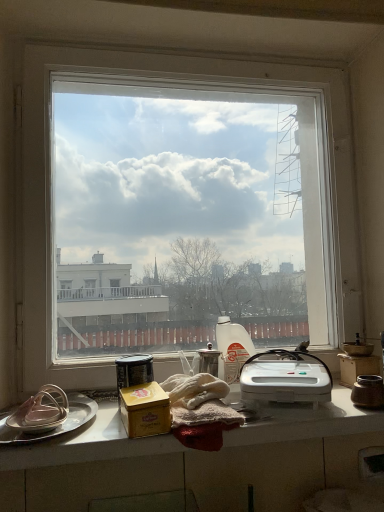
Question: From the image's perspective, is transparent glass window at center under silver metallic platter at left?

Choices:
 (A) yes
 (B) no

Answer: (B)

Question: Does transparent glass window at center lie behind silver metallic platter at left?

Choices:
 (A) no
 (B) yes

Answer: (B)

Question: Considering the relative sizes of transparent glass window at center and silver metallic platter at left in the image provided, is transparent glass window at center bigger than silver metallic platter at left?

Choices:
 (A) no
 (B) yes

Answer: (B)

Question: Is transparent glass window at center completely or partially outside of silver metallic platter at left?

Choices:
 (A) no
 (B) yes

Answer: (B)

Question: Is transparent glass window at center at the left side of silver metallic platter at left?

Choices:
 (A) no
 (B) yes

Answer: (A)

Question: In terms of width, does white glossy countertop at lower center look wider or thinner when compared to matte silver lid at left, marked as the first appliance in a left-to-right arrangement?

Choices:
 (A) thin
 (B) wide

Answer: (B)

Question: Is point (329, 483) closer or farther from the camera than point (41, 417)?

Choices:
 (A) closer
 (B) farther

Answer: (B)

Question: Is white glossy countertop at lower center to the left or to the right of matte silver lid at left, marked as the first appliance in a left-to-right arrangement, in the image?

Choices:
 (A) left
 (B) right

Answer: (B)

Question: From their relative heights in the image, would you say white glossy countertop at lower center is taller or shorter than matte silver lid at left, the sixth appliance when ordered from right to left?

Choices:
 (A) tall
 (B) short

Answer: (B)

Question: Considering the positions of transparent glass window at center and metallic canister at center, marked as the second appliance in a left-to-right arrangement, in the image, is transparent glass window at center bigger or smaller than metallic canister at center, marked as the second appliance in a left-to-right arrangement,?

Choices:
 (A) small
 (B) big

Answer: (B)

Question: Is point (170, 297) closer or farther from the camera than point (122, 378)?

Choices:
 (A) farther
 (B) closer

Answer: (A)

Question: From their relative heights in the image, would you say transparent glass window at center is taller or shorter than metallic canister at center, the fifth appliance viewed from the right?

Choices:
 (A) short
 (B) tall

Answer: (B)

Question: Would you say transparent glass window at center is inside or outside metallic canister at center, the fifth appliance viewed from the right?

Choices:
 (A) outside
 (B) inside

Answer: (A)

Question: In terms of height, does brown ceramic jar at right, the 6th appliance positioned from the left, look taller or shorter compared to satin silver teapot at center, which appears as the 3th appliance when viewed from the right?

Choices:
 (A) short
 (B) tall

Answer: (A)

Question: Considering their positions, is brown ceramic jar at right, the 6th appliance positioned from the left, located in front of or behind satin silver teapot at center, which appears as the 3th appliance when viewed from the right?

Choices:
 (A) front
 (B) behind

Answer: (A)